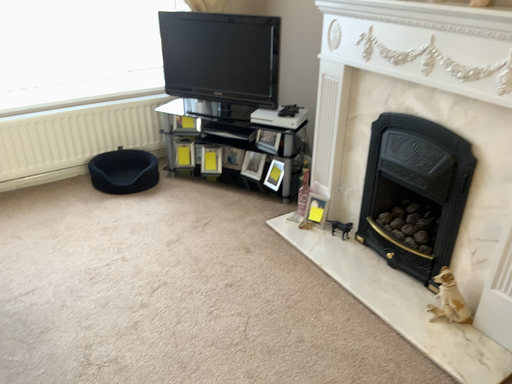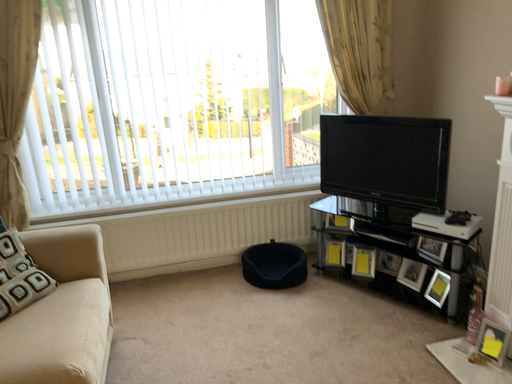
Question: How did the camera likely rotate when shooting the video?

Choices:
 (A) rotated upward
 (B) rotated downward

Answer: (A)